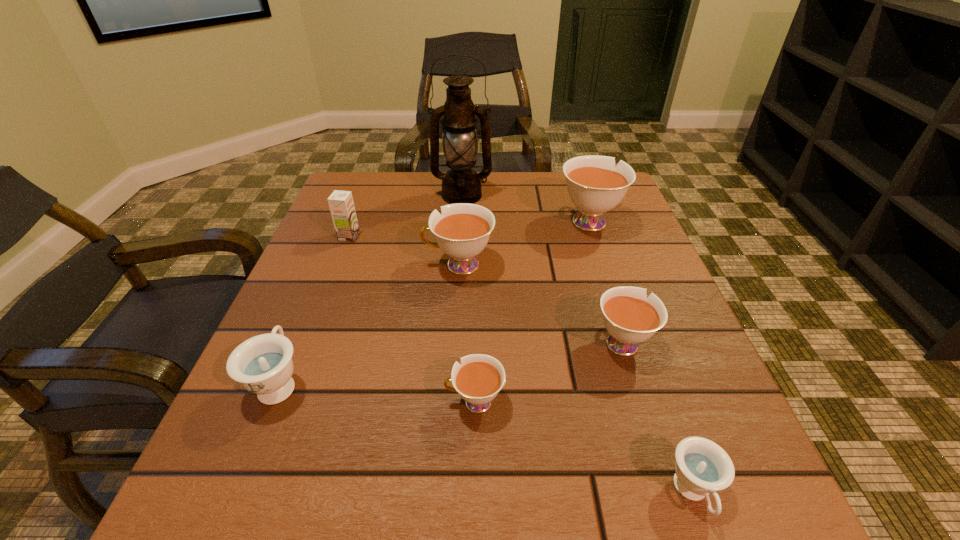
Find the location of a particular element. This screenshot has height=540, width=960. vacant position located on the side of the second smallest white teacup with the handle is located at coordinates pyautogui.click(x=578, y=204).

Where is `vacant space located on the side of the second smallest white teacup with the handle`? The height and width of the screenshot is (540, 960). vacant space located on the side of the second smallest white teacup with the handle is located at coordinates (584, 222).

Find the location of `vacant position located on the side of the farther blue teacup with the handle`. vacant position located on the side of the farther blue teacup with the handle is located at coordinates (336, 244).

This screenshot has height=540, width=960. I want to click on free space located on the side of the farther blue teacup with the handle, so click(x=310, y=307).

Where is `free spot located on the side of the farther blue teacup with the handle`? This screenshot has height=540, width=960. free spot located on the side of the farther blue teacup with the handle is located at coordinates (336, 244).

Identify the location of vacant point located 0.080m on the side of the smallest white teacup with the handle. This screenshot has width=960, height=540. (394, 402).

You are a GUI agent. You are given a task and a screenshot of the screen. Output one action in this format:
    pyautogui.click(x=<x>, y=<y>)
    Task: Click on the vacant space located 0.180m on the side of the smallest white teacup with the handle
    This screenshot has height=540, width=960.
    Given the screenshot: What is the action you would take?
    pyautogui.click(x=328, y=402)

The image size is (960, 540). I want to click on free region located 0.160m on the side of the smallest white teacup with the handle, so click(x=342, y=402).

Where is `oil lamp that is positioned at the far edge`? The height and width of the screenshot is (540, 960). oil lamp that is positioned at the far edge is located at coordinates (461, 184).

The width and height of the screenshot is (960, 540). I want to click on teacup that is at the far edge, so click(x=594, y=185).